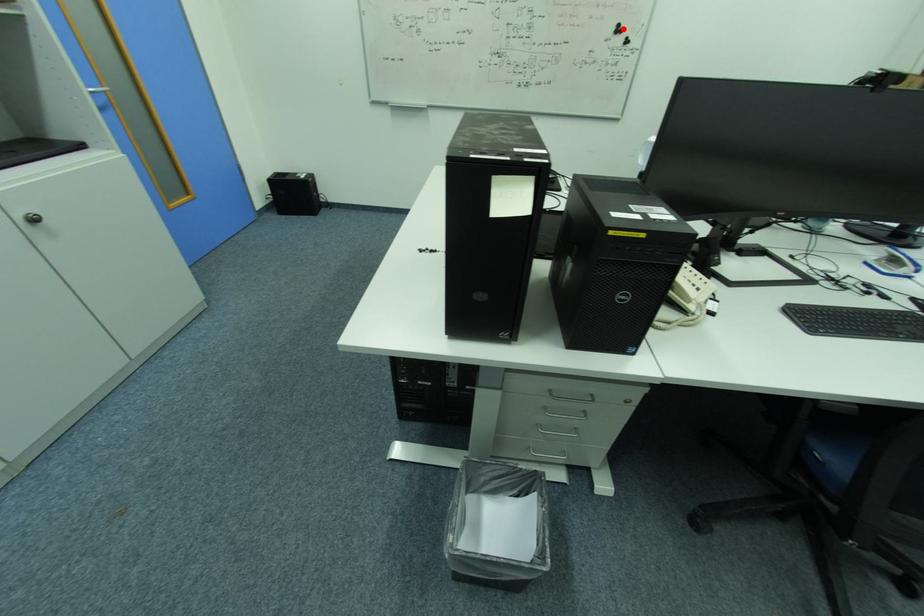
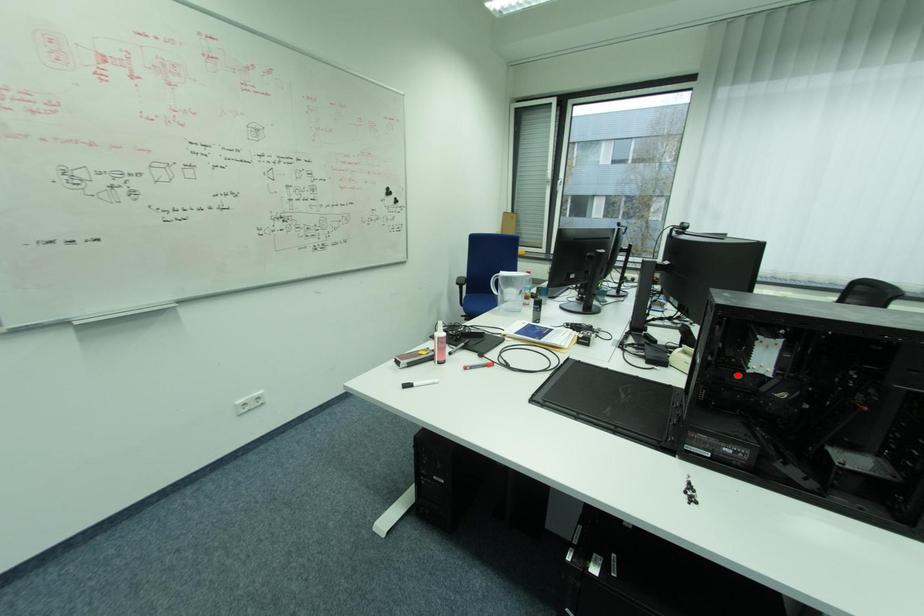
I am providing you with two images of the same scene from different viewpoints. A red point is marked on the first image and another point is marked on the second image. Do the highlighted points in image1 and image2 indicate the same real-world spot?

No